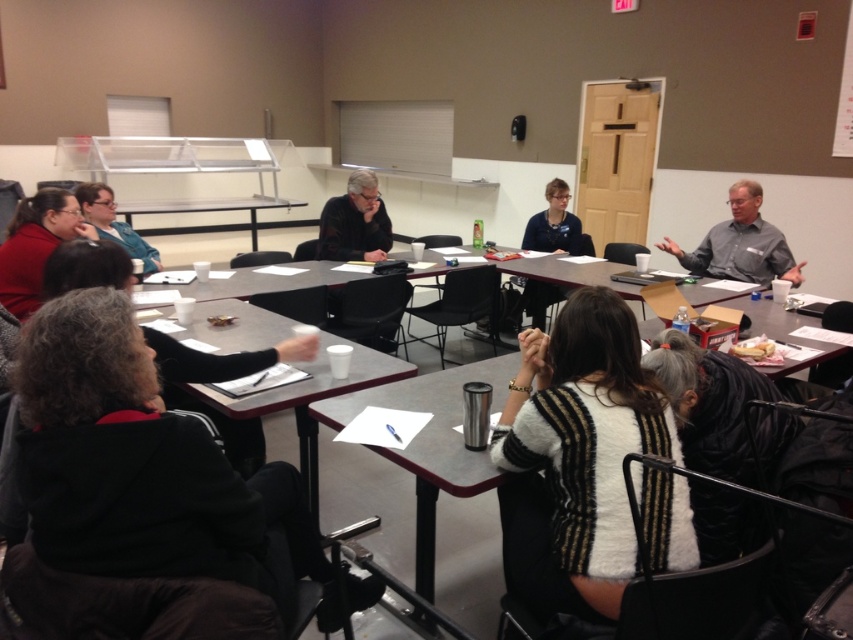
Question: Can you confirm if black fleece jacket at lower left is positioned above matte black sweater at upper left?

Choices:
 (A) yes
 (B) no

Answer: (B)

Question: Which of the following is the closest to the observer?

Choices:
 (A) gray shirt at upper right
 (B) matte black shirt at center
 (C) white fuzzy sweater at center

Answer: (C)

Question: Which of the following is the closest to the observer?

Choices:
 (A) click(x=19, y=272)
 (B) click(x=254, y=324)

Answer: (B)

Question: Considering the relative positions of white paper at center and matte black sweater at upper left in the image provided, where is white paper at center located with respect to matte black sweater at upper left?

Choices:
 (A) left
 (B) right

Answer: (B)

Question: Which object is farther from the camera taking this photo?

Choices:
 (A) matte black sweater at upper left
 (B) white fuzzy sweater at center

Answer: (A)

Question: Is black fleece jacket at lower left positioned at the back of white fuzzy sweater at center?

Choices:
 (A) yes
 (B) no

Answer: (B)